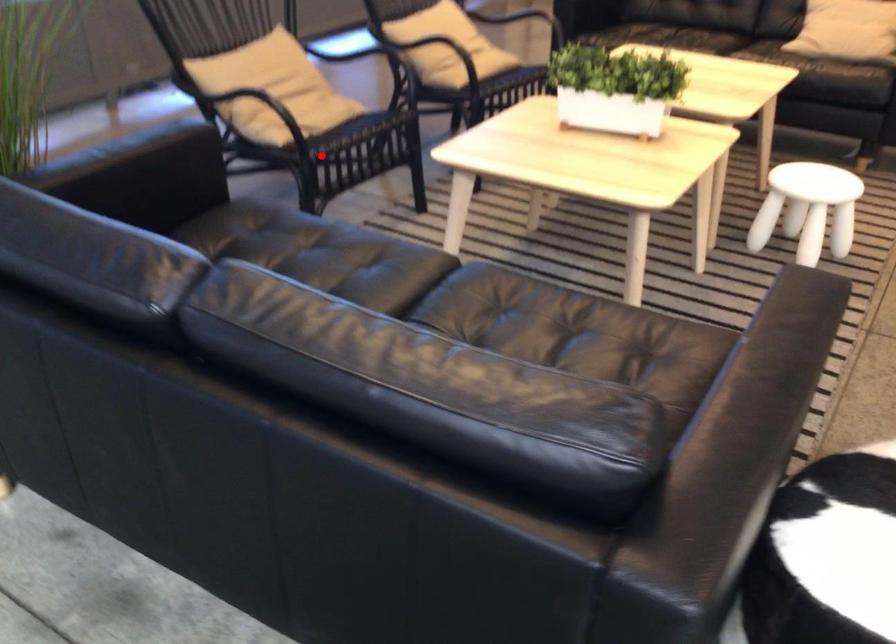
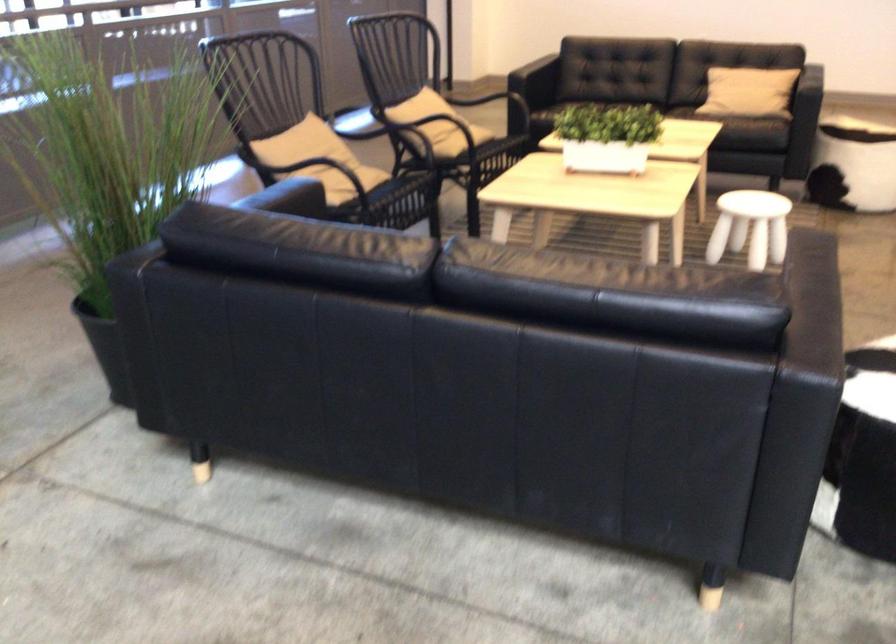
Locate, in the second image, the point that corresponds to the highlighted location in the first image.

(382, 204)